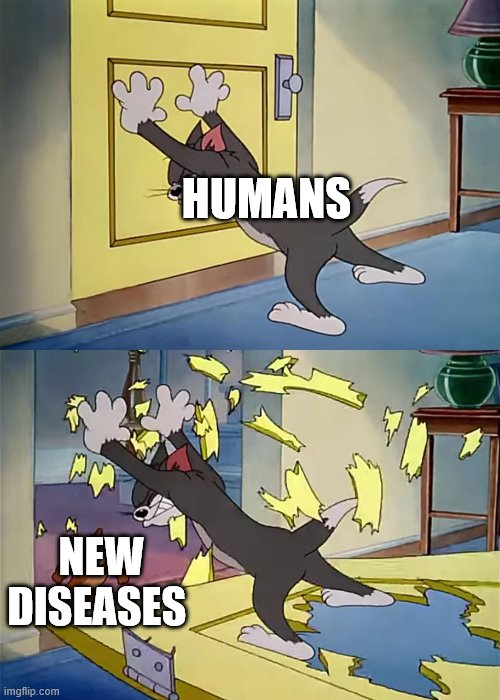
Identify the location of door blown open. (250, 682).